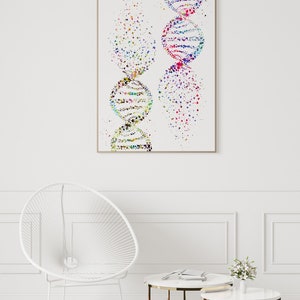
At what (x,y) coordinates should I click in order to perform the action: click on left and right bottom corner of frame around canvas. Please return your answer as a coordinate pair (x, y). Looking at the image, I should click on (213, 151), (98, 151).